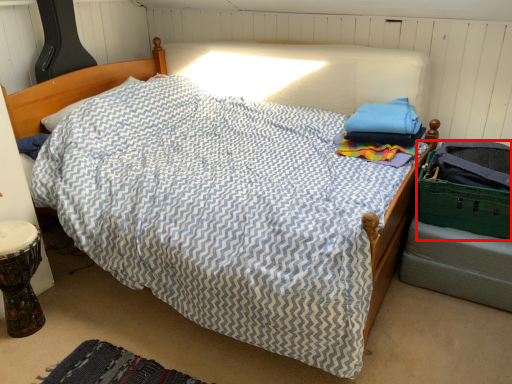
Question: From the image's perspective, what is the correct spatial positioning of laundry basket (annotated by the red box) in reference to mat?

Choices:
 (A) above
 (B) below

Answer: (A)